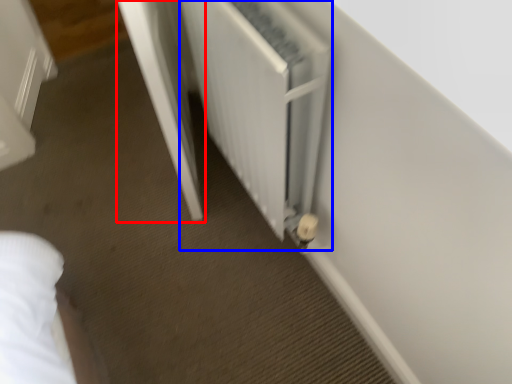
Question: Which of the following is the closest to the observer, screen door (highlighted by a red box) or radiator (highlighted by a blue box)?

Choices:
 (A) screen door
 (B) radiator

Answer: (B)